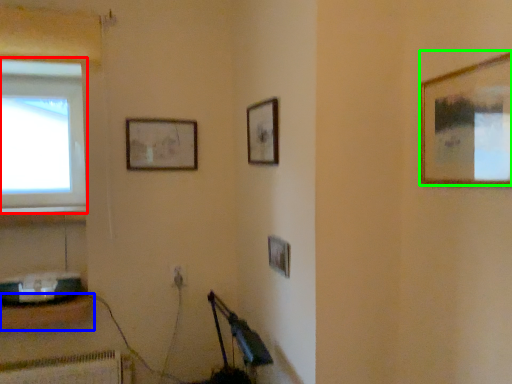
Question: Estimate the real-world distances between objects in this image. Which object is closer to window (highlighted by a red box), furniture (highlighted by a blue box) or picture frame (highlighted by a green box)?

Choices:
 (A) furniture
 (B) picture frame

Answer: (A)